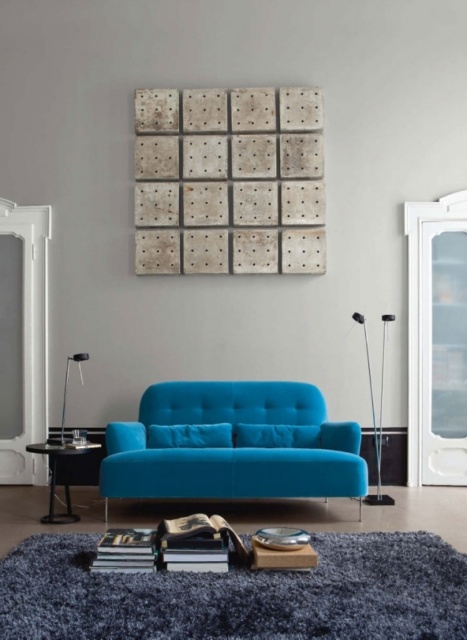
Is teal velvet sofa at center thinner than matte black side table at lower left?

No.

Which is in front, point (337, 426) or point (89, 449)?

Point (89, 449)

Image resolution: width=467 pixels, height=640 pixels. In order to click on teal velvet sofa at center in this screenshot , I will do `click(233, 444)`.